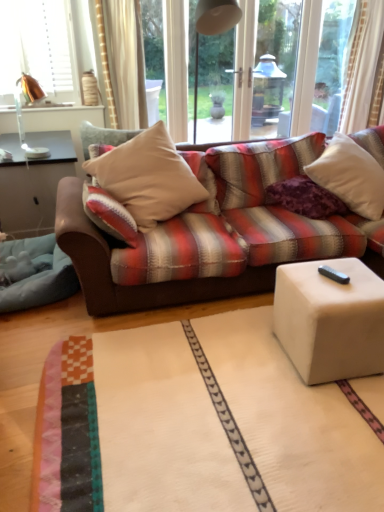
Image resolution: width=384 pixels, height=512 pixels. Find the location of `unoccupied space behind black plastic remote control at lower right`. unoccupied space behind black plastic remote control at lower right is located at coordinates (335, 263).